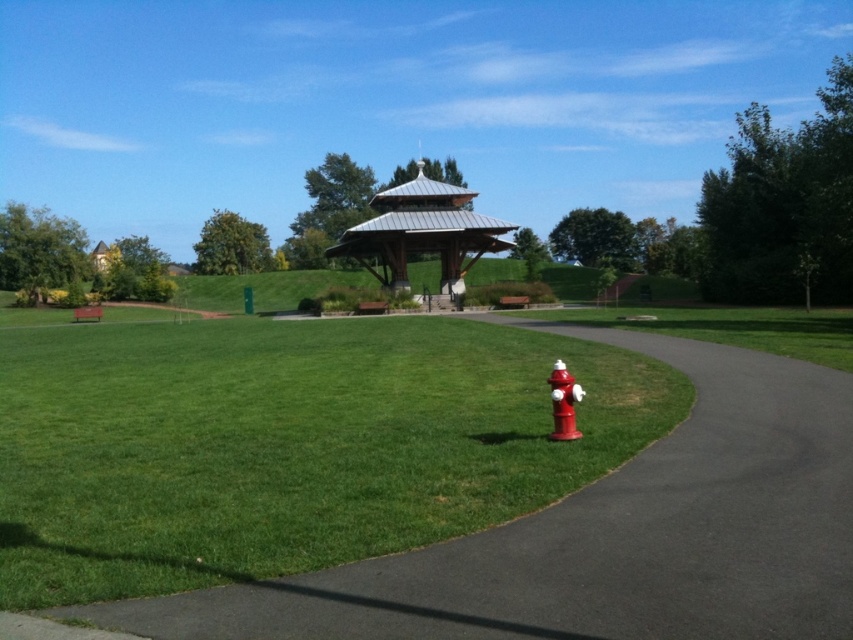
Question: Which object is positioned farthest from the shiny red fire hydrant at lower right?

Choices:
 (A) smooth asphalt pavement at center
 (B) metallic silver gazebo at center

Answer: (B)

Question: From the image, what is the correct spatial relationship of smooth asphalt pavement at center in relation to shiny red fire hydrant at lower right?

Choices:
 (A) right
 (B) left

Answer: (A)

Question: Can you confirm if smooth asphalt pavement at center is smaller than metallic silver gazebo at center?

Choices:
 (A) no
 (B) yes

Answer: (B)

Question: Is smooth asphalt pavement at center positioned in front of metallic silver gazebo at center?

Choices:
 (A) yes
 (B) no

Answer: (A)

Question: Which object appears farthest from the camera in this image?

Choices:
 (A) metallic silver gazebo at center
 (B) smooth asphalt pavement at center
 (C) shiny red fire hydrant at lower right

Answer: (A)

Question: Which point is closer to the camera?

Choices:
 (A) smooth asphalt pavement at center
 (B) shiny red fire hydrant at lower right
 (C) metallic silver gazebo at center

Answer: (A)